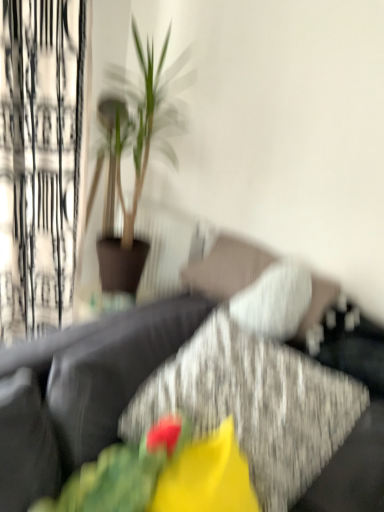
Question: Is white sheer curtain at left to the right of matte yellow flower at center from the viewer's perspective?

Choices:
 (A) yes
 (B) no

Answer: (B)

Question: Does white sheer curtain at left have a greater width compared to matte yellow flower at center?

Choices:
 (A) yes
 (B) no

Answer: (B)

Question: Considering the relative sizes of white sheer curtain at left and matte yellow flower at center in the image provided, is white sheer curtain at left smaller than matte yellow flower at center?

Choices:
 (A) yes
 (B) no

Answer: (B)

Question: Is matte yellow flower at center surrounded by white sheer curtain at left?

Choices:
 (A) no
 (B) yes

Answer: (A)

Question: From a real-world perspective, is white sheer curtain at left on matte yellow flower at center?

Choices:
 (A) yes
 (B) no

Answer: (A)

Question: Does white sheer curtain at left have a lesser width compared to matte yellow flower at center?

Choices:
 (A) yes
 (B) no

Answer: (A)

Question: Is matte yellow flower at center far away from green leafy plant at upper left?

Choices:
 (A) no
 (B) yes

Answer: (B)

Question: Is matte yellow flower at center bigger than green leafy plant at upper left?

Choices:
 (A) no
 (B) yes

Answer: (A)

Question: From a real-world perspective, is matte yellow flower at center physically below green leafy plant at upper left?

Choices:
 (A) no
 (B) yes

Answer: (B)

Question: From a real-world perspective, is matte yellow flower at center positioned over green leafy plant at upper left based on gravity?

Choices:
 (A) no
 (B) yes

Answer: (A)

Question: Is matte yellow flower at center behind green leafy plant at upper left?

Choices:
 (A) no
 (B) yes

Answer: (A)

Question: Can you confirm if matte yellow flower at center is smaller than green leafy plant at upper left?

Choices:
 (A) yes
 (B) no

Answer: (A)

Question: Could you tell me if green leafy plant at upper left is turned towards matte yellow flower at center?

Choices:
 (A) no
 (B) yes

Answer: (A)